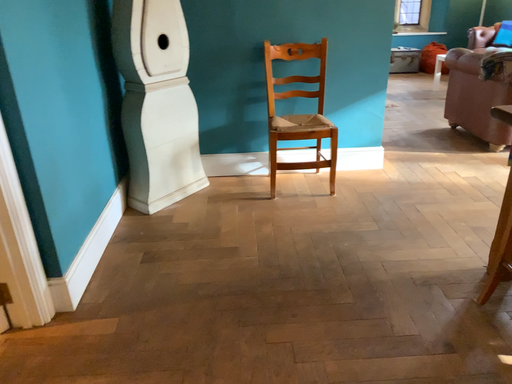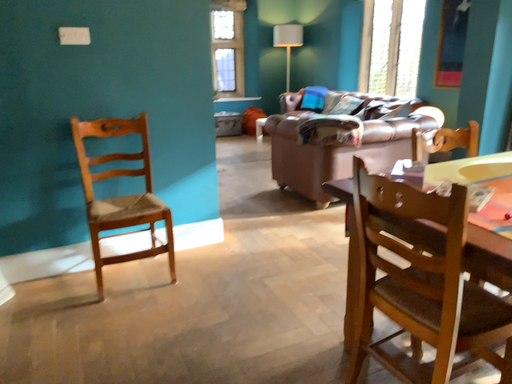
Question: How did the camera likely rotate when shooting the video?

Choices:
 (A) rotated upward
 (B) rotated downward

Answer: (A)